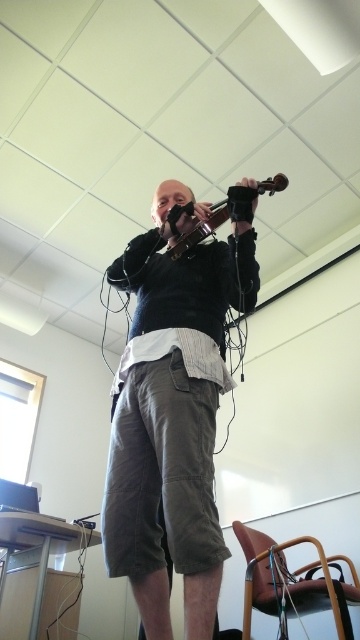
In the scene shown: You are a photographer setting up for a shoot in the classroom. You need to position a camera so that both the dark gray cotton shorts at center and the wooden violin at upper center are in the frame. Which object should you focus on first to ensure both are in focus?

You should focus on the wooden violin at upper center first because the dark gray cotton shorts at center is positioned under it, meaning the violin is closer to the camera and requires focusing on the foreground object first to maintain both in focus.

Looking at this image, you are a photographer standing in the same room as the person playing the violin. You want to take a closeup photo of the dark gray cotton shorts at center. Based on their position coordinates, where should you position your camera to capture them effectively?

The dark gray cotton shorts at center are located at coordinates point (172,419). To capture them effectively, position your camera so that it is focused on this coordinate point.